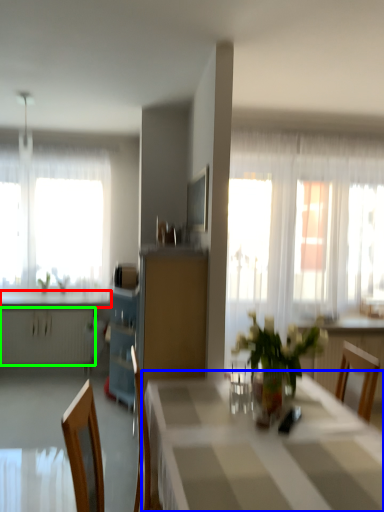
Question: Estimate the real-world distances between objects in this image. Which object is closer to countertop (highlighted by a red box), table (highlighted by a blue box) or radiator (highlighted by a green box)?

Choices:
 (A) table
 (B) radiator

Answer: (B)